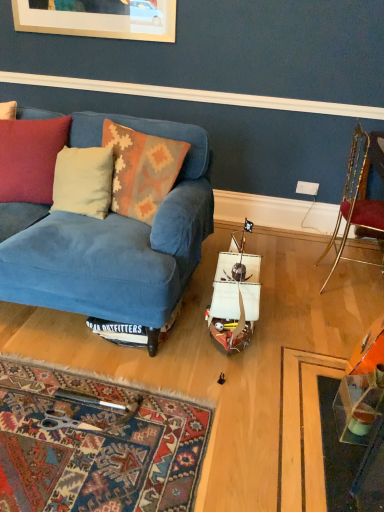
I want to click on free region on the left part of transparent plastic table at lower right, so click(306, 425).